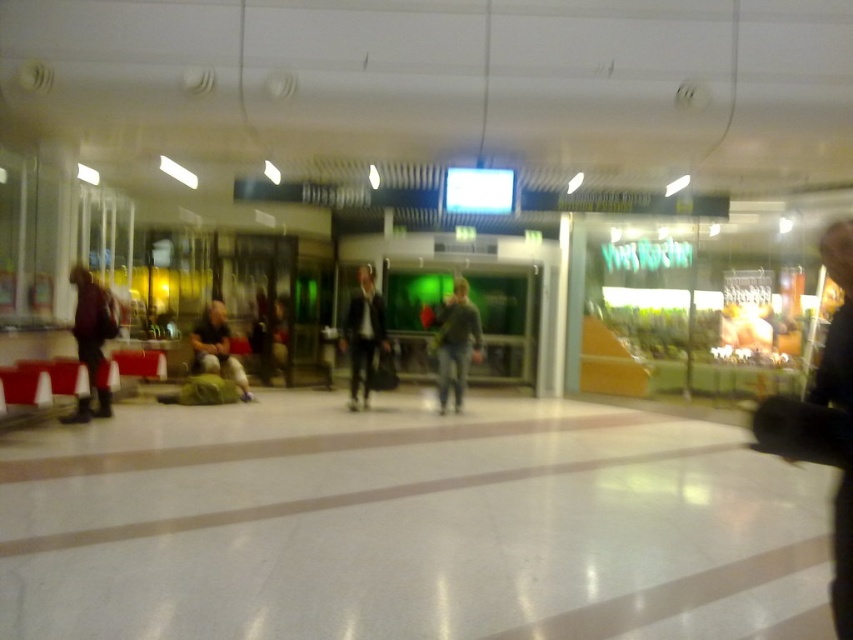
Can you confirm if black leather jacket at right is taller than dark blue suit at center?

Incorrect, black leather jacket at right's height is not larger of dark blue suit at center's.

Can you confirm if black leather jacket at right is bigger than dark blue suit at center?

Actually, black leather jacket at right might be smaller than dark blue suit at center.

Where is `black leather jacket at right`? The image size is (853, 640). black leather jacket at right is located at coordinates (824, 419).

What are the coordinates of `black leather jacket at right` in the screenshot? It's located at (824, 419).

Looking at this image, how distant is black leather jacket at right from dark gray sweater at center?

black leather jacket at right and dark gray sweater at center are 7.20 meters apart.

Describe the element at coordinates (824, 419) in the screenshot. I see `black leather jacket at right` at that location.

At what (x,y) coordinates should I click in order to perform the action: click on black leather jacket at right. Please return your answer as a coordinate pair (x, y). The width and height of the screenshot is (853, 640). Looking at the image, I should click on (824, 419).

Which is behind, point (364, 378) or point (234, 362)?

The point (234, 362) is behind.

Is dark blue suit at center to the right of green fabric bag at center from the viewer's perspective?

Indeed, dark blue suit at center is positioned on the right side of green fabric bag at center.

Does point (364, 275) come in front of point (195, 348)?

Yes, point (364, 275) is closer to viewer.

Locate an element on the screen. dark blue suit at center is located at coordinates (363, 333).